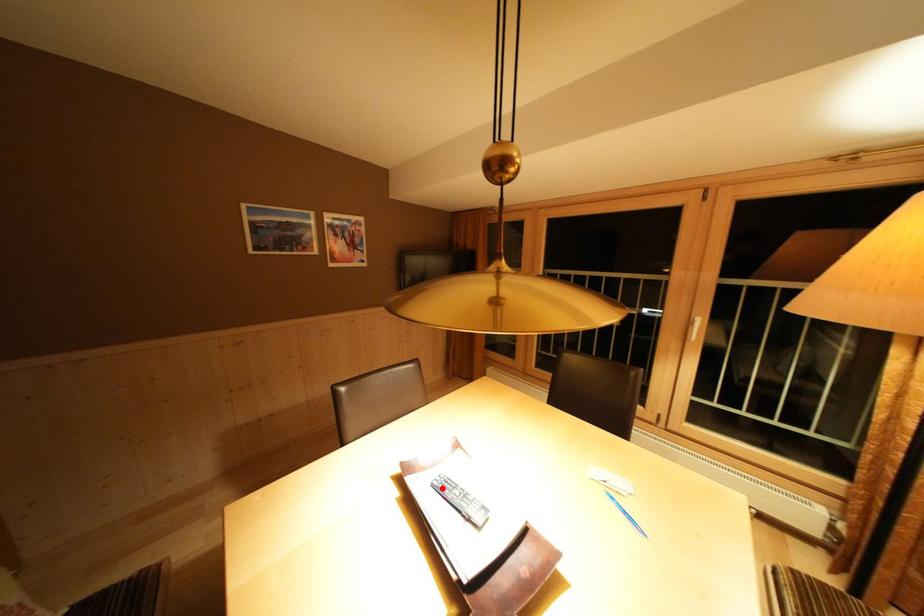
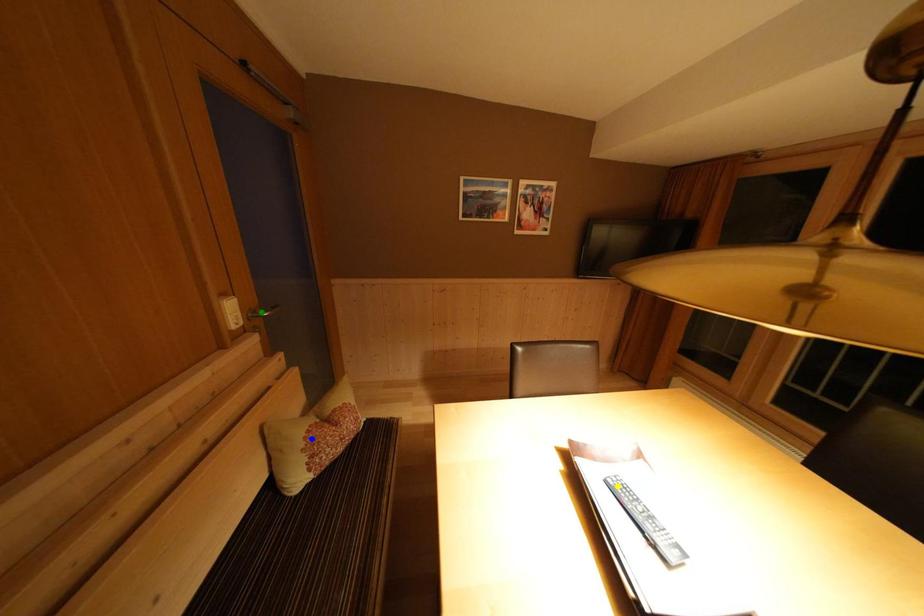
Question: I am providing you with two images of the same scene from different viewpoints. A red point is marked on the first image. You are given multiple points on the second image. Which point in image 2 is actually the same real-world point as the red point in image 1?

Choices:
 (A) blue point
 (B) yellow point
 (C) green point

Answer: (B)